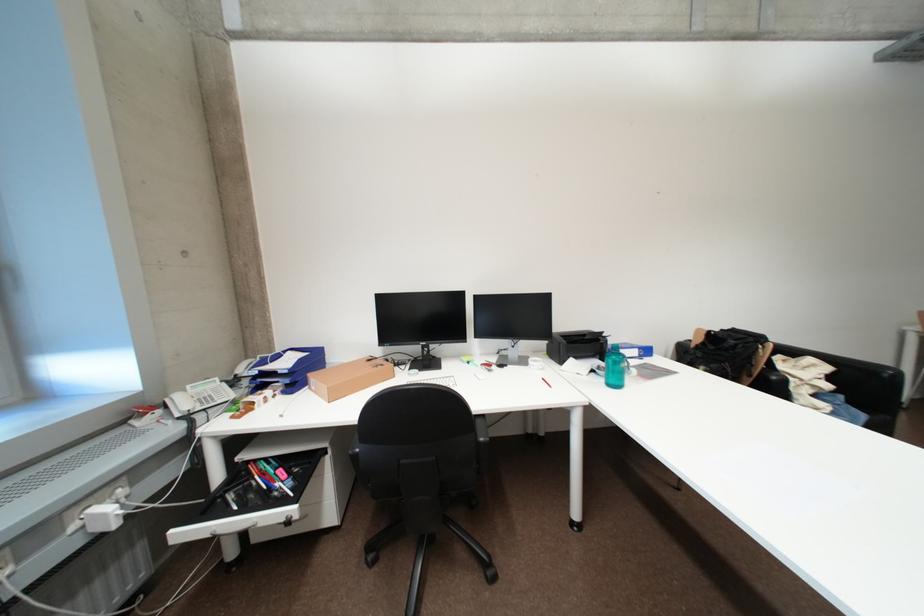
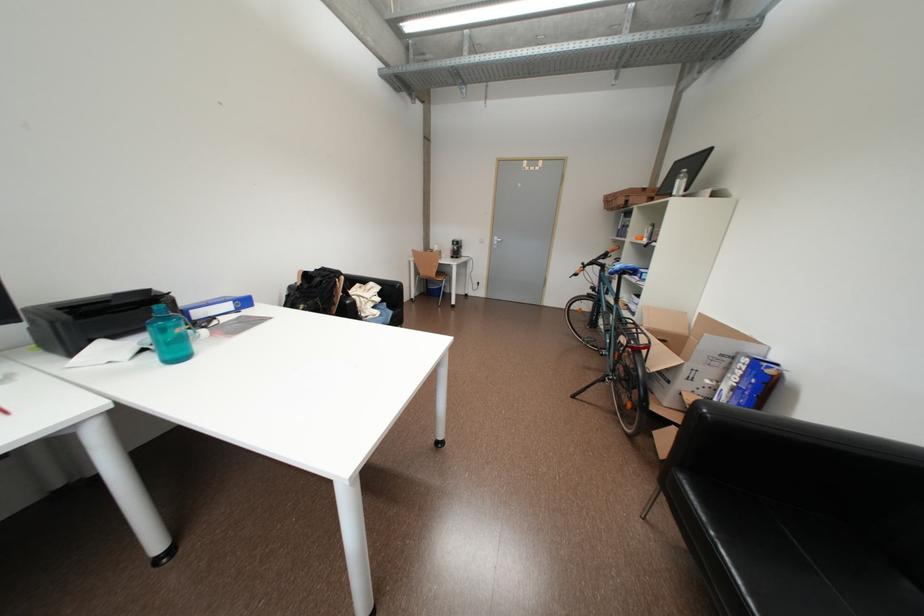
Find the pixel in the second image that matches point 654,353 in the first image.

(252, 304)